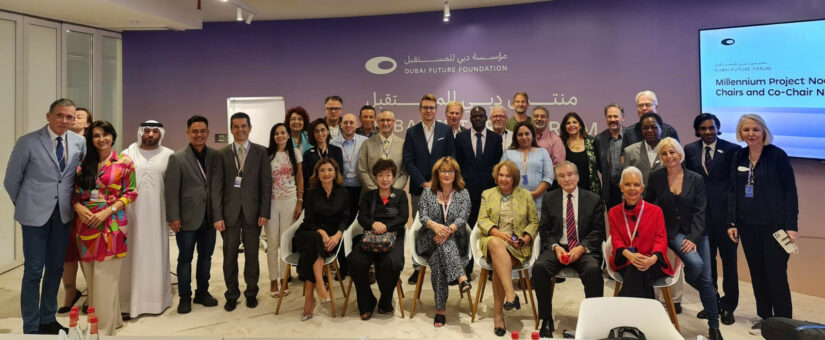
This screenshot has width=825, height=340. Identify the location of light. (446, 16), (242, 21).